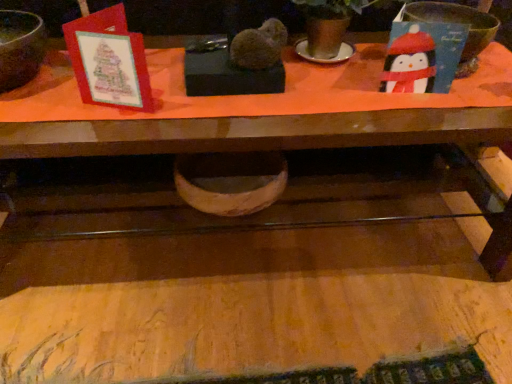
Identify the location of vacant space to the right of matte brown mixing bowl at upper left. (81, 97).